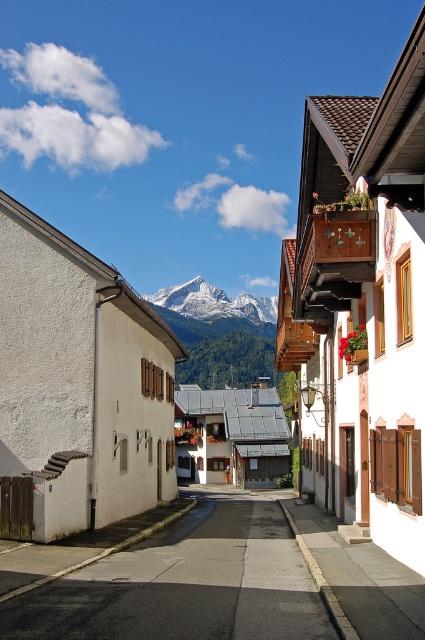
You are a delivery drone flying over the mountain village. Your GPS coordinates show that you need to land on the smooth asphalt road at center. According to the map, where exactly should you aim to land?

You should aim to land at the coordinates point (x=186, y=584) as that is where the smooth asphalt road at center is located.